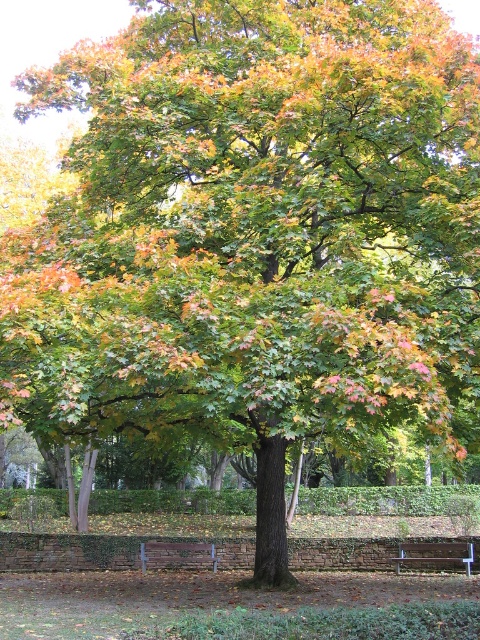
Question: Is wooden bench at lower right further to the viewer compared to brown wooden bench at lower center?

Choices:
 (A) yes
 (B) no

Answer: (B)

Question: Which of the following is the farthest from the observer?

Choices:
 (A) (143, 605)
 (B) (188, 554)
 (C) (415, 560)

Answer: (B)

Question: Which object is the closest to the wooden bench at lower right?

Choices:
 (A) brown wooden bench at lower center
 (B) green leafy tree at center

Answer: (B)

Question: Considering the relative positions of green leafy tree at center and brown wooden bench at lower center in the image provided, where is green leafy tree at center located with respect to brown wooden bench at lower center?

Choices:
 (A) above
 (B) below

Answer: (A)

Question: Among these points, which one is nearest to the camera?

Choices:
 (A) (435, 552)
 (B) (271, 612)
 (C) (187, 561)

Answer: (B)

Question: Can you confirm if green leafy tree at center is wider than wooden bench at lower right?

Choices:
 (A) yes
 (B) no

Answer: (A)